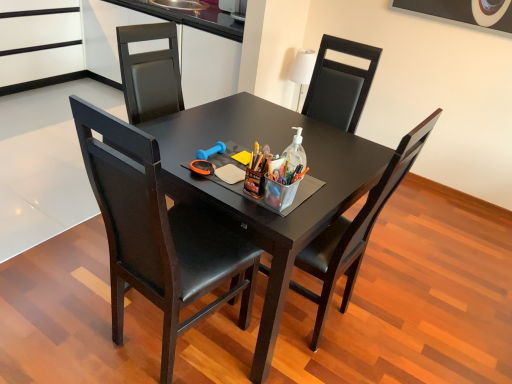
Where is `vacant area to the right of translucent plastic bottle at center`? Image resolution: width=512 pixels, height=384 pixels. vacant area to the right of translucent plastic bottle at center is located at coordinates (328, 175).